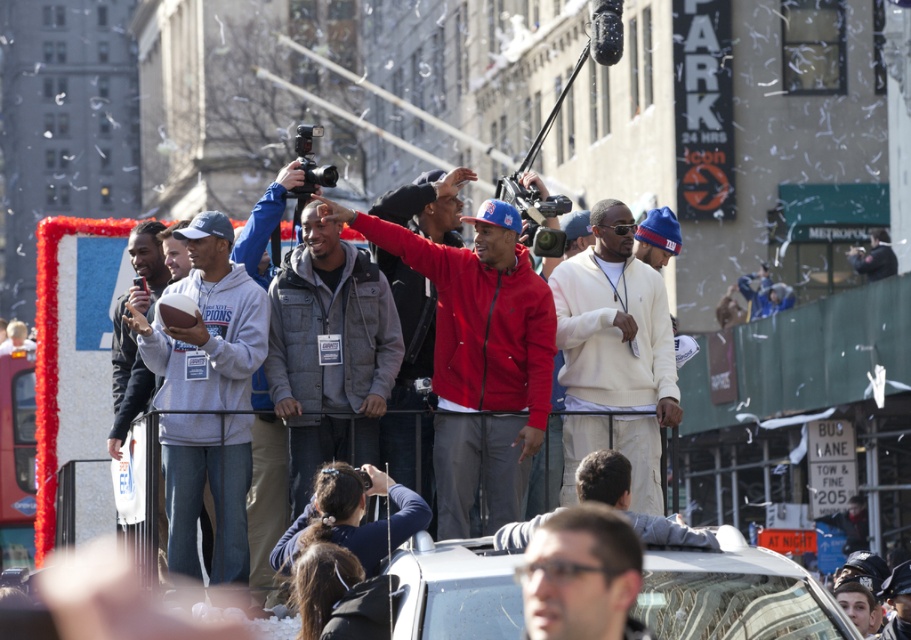
Question: Is gray puffy jacket at center positioned behind clear plastic glasses at center?

Choices:
 (A) no
 (B) yes

Answer: (B)

Question: Can you confirm if light beige sweater at center is thinner than black plastic video camera at upper center?

Choices:
 (A) no
 (B) yes

Answer: (B)

Question: Which of the following is the farthest from the observer?

Choices:
 (A) red matte jacket at center
 (B) light beige sweater at center

Answer: (A)

Question: Can you confirm if gray fleece sweatshirt at center is smaller than clear plastic glasses at center?

Choices:
 (A) yes
 (B) no

Answer: (B)

Question: Which object appears farthest from the camera in this image?

Choices:
 (A) gray puffy jacket at center
 (B) dark gray jacket at center

Answer: (B)

Question: Considering the real-world distances, which object is closest to the gray fleece sweatshirt at left?

Choices:
 (A) white fleece jacket at center
 (B) gray fleece sweatshirt at center

Answer: (B)